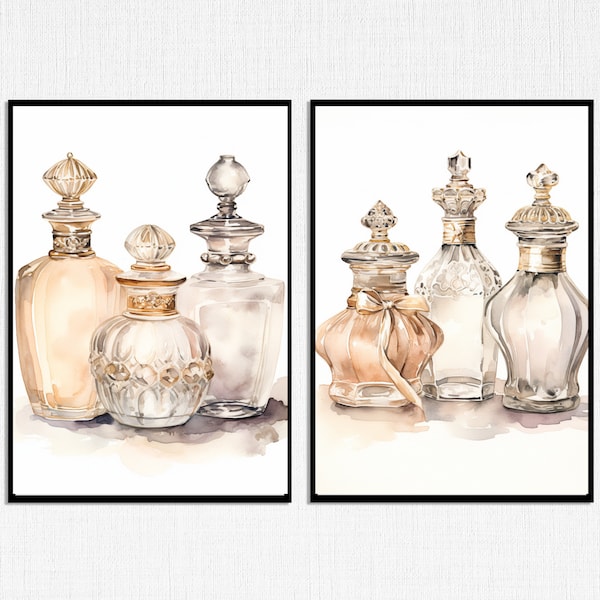
The width and height of the screenshot is (600, 600). In order to click on small ornate vase with decorations around centre in this screenshot , I will do `click(143, 349)`.